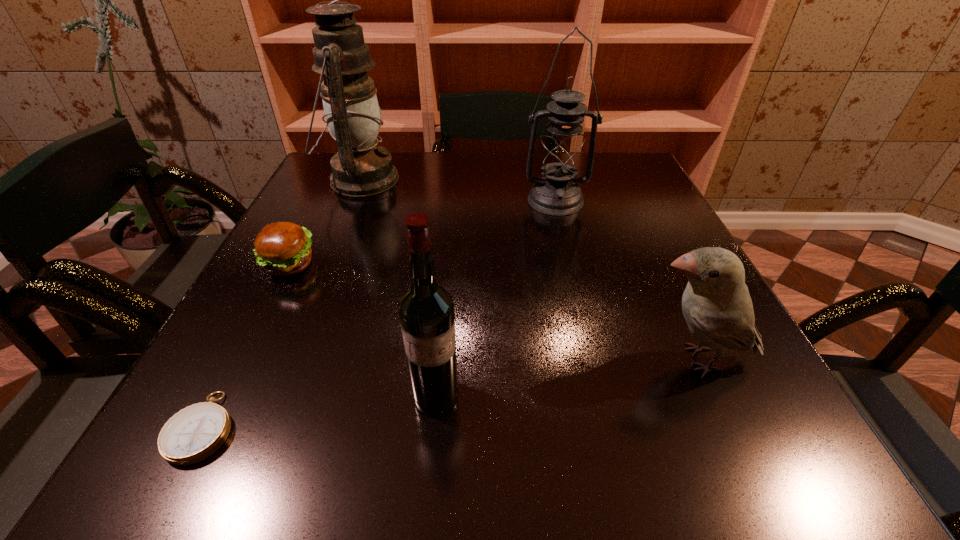
You are a GUI agent. You are given a task and a screenshot of the screen. Output one action in this format:
    pyautogui.click(x=<x>, y=<y>)
    Task: Click on the free space located at the face of the bird
    This screenshot has width=960, height=540.
    Given the screenshot: What is the action you would take?
    pyautogui.click(x=568, y=360)

This screenshot has width=960, height=540. I want to click on vacant area situated 0.250m at the face of the bird, so click(481, 360).

Where is `vacant space located 0.370m at the face of the bird`? The width and height of the screenshot is (960, 540). vacant space located 0.370m at the face of the bird is located at coordinates (406, 360).

Find the location of `free space located 0.230m on the front of the hamburger`. free space located 0.230m on the front of the hamburger is located at coordinates (228, 383).

The height and width of the screenshot is (540, 960). Identify the location of free spot located 0.110m on the back of the compass. (250, 336).

Find the location of a particular element. wine bottle present at the near edge is located at coordinates (426, 310).

Where is `compass at the near edge`? The width and height of the screenshot is (960, 540). compass at the near edge is located at coordinates (193, 434).

The width and height of the screenshot is (960, 540). In order to click on lantern that is at the left edge in this screenshot , I will do `click(353, 117)`.

Identify the location of hamburger that is at the left edge. (284, 248).

The width and height of the screenshot is (960, 540). Find the location of `compass at the left edge`. compass at the left edge is located at coordinates (193, 434).